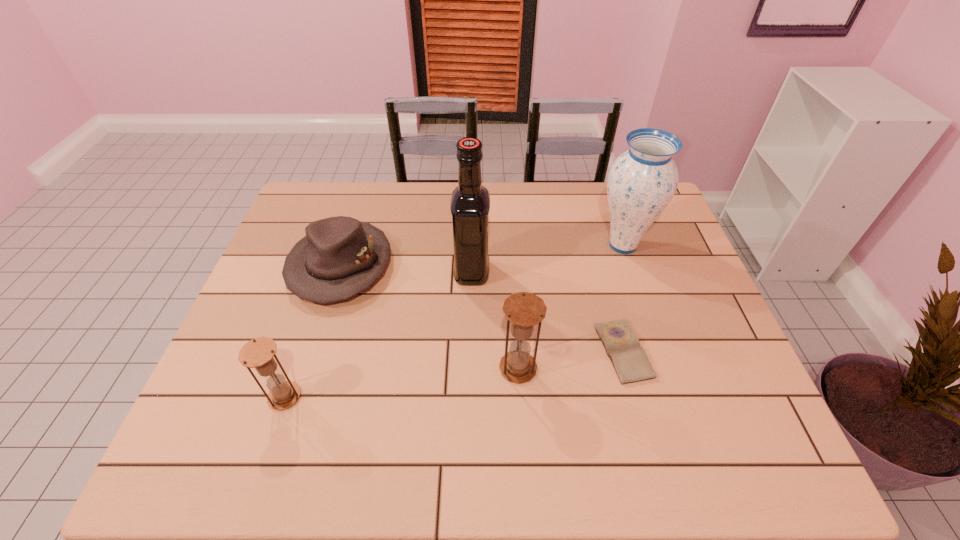
I want to click on vacant space that satisfies the following two spatial constraints: 1. on the decorative side of the shortest object; 2. on the right side of the hat, so click(x=314, y=351).